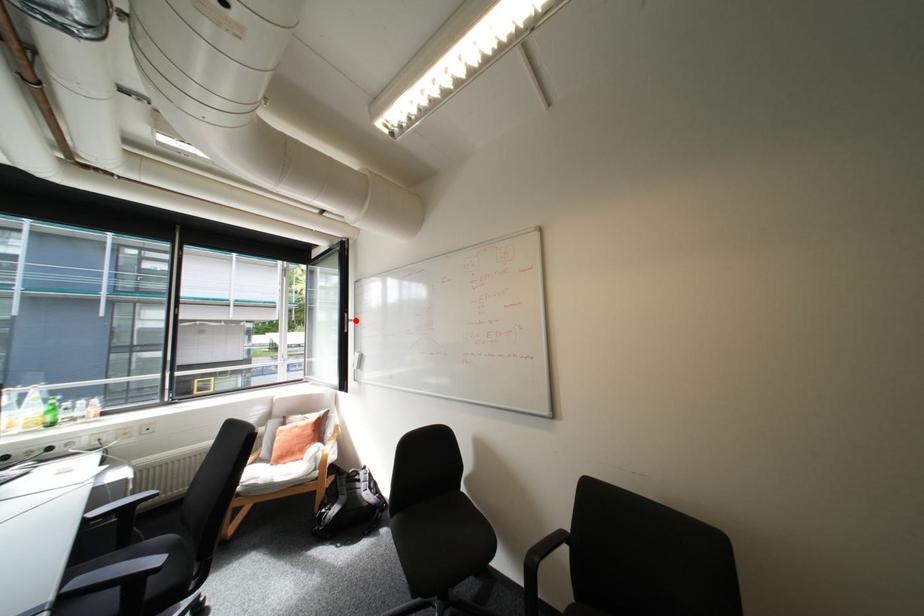
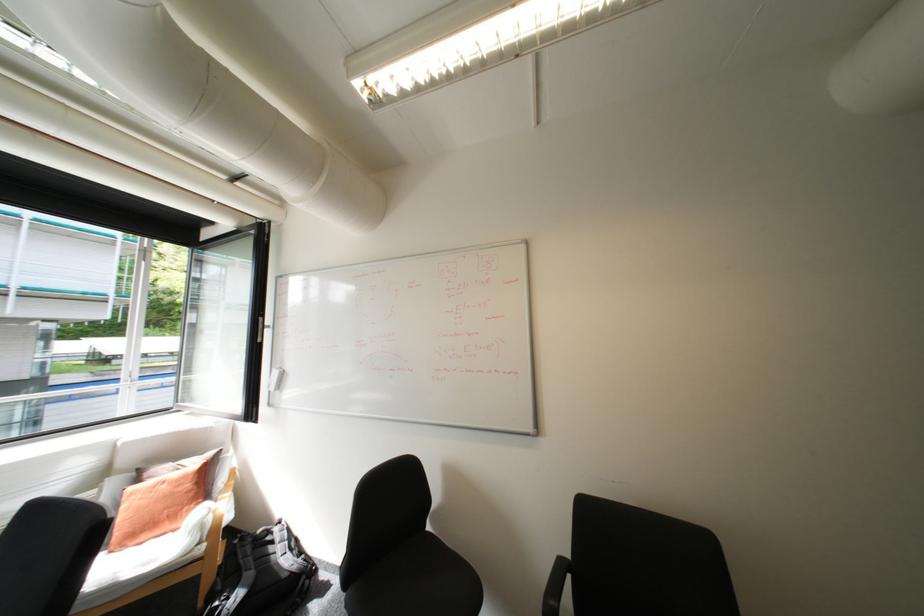
The point at the highlighted location is marked in the first image. Where is the corresponding point in the second image?

(271, 326)